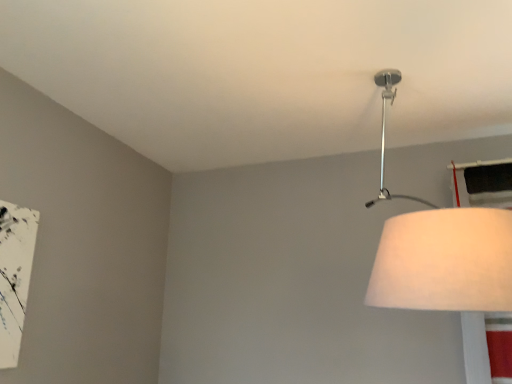
Measure the distance between point [506,252] and camera.

Point [506,252] and camera are 38.54 inches apart.

You are a GUI agent. You are given a task and a screenshot of the screen. Output one action in this format:
    pyautogui.click(x=<x>, y=<y>)
    Task: Click on the white fabric lampshade at upper right
    The height and width of the screenshot is (384, 512).
    Given the screenshot: What is the action you would take?
    pyautogui.click(x=445, y=261)

This screenshot has height=384, width=512. What do you see at coordinates (445, 261) in the screenshot?
I see `white fabric lampshade at upper right` at bounding box center [445, 261].

The image size is (512, 384). Find the location of `white fabric lampshade at upper right`. white fabric lampshade at upper right is located at coordinates (445, 261).